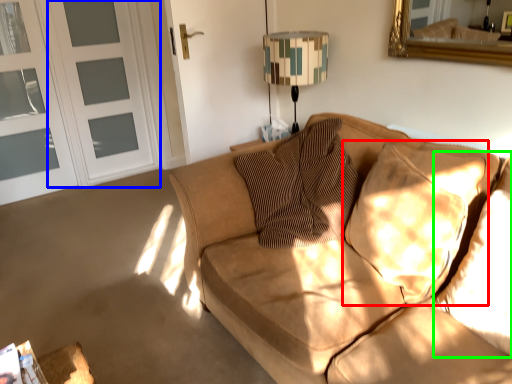
Question: Which object is positioned closest to pillow (highlighted by a red box)? Select from screen door (highlighted by a blue box) and pillow (highlighted by a green box).

Choices:
 (A) screen door
 (B) pillow

Answer: (B)